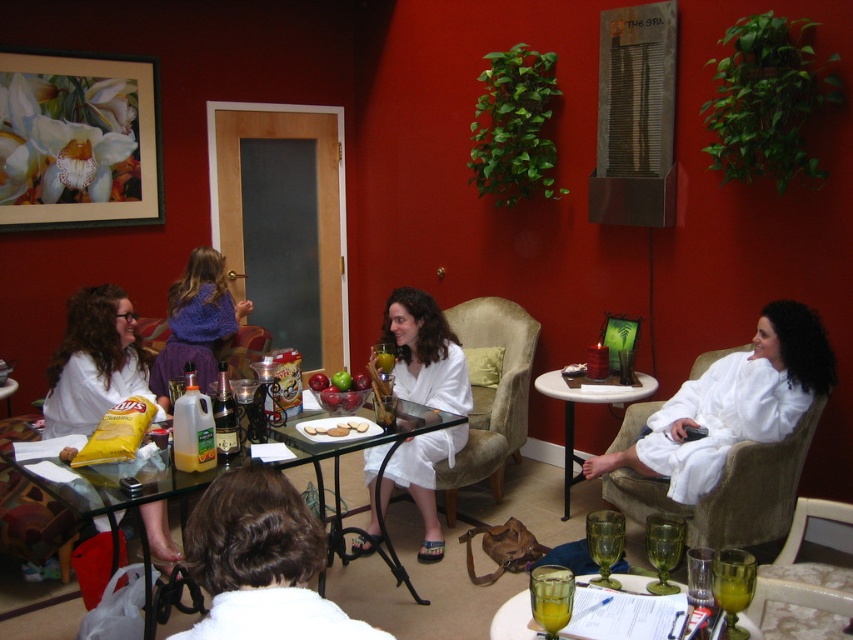
Is yellow plastic jug at lower left further to the viewer compared to translucent glass table at lower center?

Yes, it is behind translucent glass table at lower center.

What do you see at coordinates (193, 429) in the screenshot? The height and width of the screenshot is (640, 853). I see `yellow plastic jug at lower left` at bounding box center [193, 429].

Image resolution: width=853 pixels, height=640 pixels. What are the coordinates of `yellow plastic jug at lower left` in the screenshot? It's located at (193, 429).

Which of these two, beige fabric armchair at center or yellow plastic jug at lower left, stands taller?

beige fabric armchair at center

Which of these two, beige fabric armchair at center or yellow plastic jug at lower left, stands shorter?

With less height is yellow plastic jug at lower left.

Find the location of a particular element. This screenshot has height=640, width=853. beige fabric armchair at center is located at coordinates (491, 396).

Between velvet beige armchair at lower right and matte glass table at center, which one has less height?

With less height is velvet beige armchair at lower right.

At what (x,y) coordinates should I click in order to perform the action: click on velvet beige armchair at lower right. Please return your answer as a coordinate pair (x, y). Image resolution: width=853 pixels, height=640 pixels. Looking at the image, I should click on 804,584.

The height and width of the screenshot is (640, 853). What are the coordinates of `velvet beige armchair at lower right` in the screenshot? It's located at (804, 584).